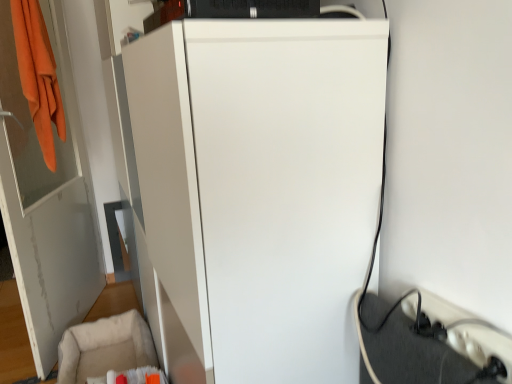
Question: Is white plastic extension cord at lower right positioned far away from white glossy door at left?

Choices:
 (A) no
 (B) yes

Answer: (B)

Question: Is white plastic extension cord at lower right smaller than white glossy door at left?

Choices:
 (A) no
 (B) yes

Answer: (B)

Question: Can we say white plastic extension cord at lower right lies outside white glossy door at left?

Choices:
 (A) no
 (B) yes

Answer: (B)

Question: Is white plastic extension cord at lower right shorter than white glossy door at left?

Choices:
 (A) yes
 (B) no

Answer: (A)

Question: Could you tell me if white plastic extension cord at lower right is turned towards white glossy door at left?

Choices:
 (A) no
 (B) yes

Answer: (A)

Question: From the image's perspective, is white glossy door at left above or below white plastic extension cord at lower right?

Choices:
 (A) below
 (B) above

Answer: (B)

Question: Is white glossy door at left inside or outside of white plastic extension cord at lower right?

Choices:
 (A) outside
 (B) inside

Answer: (A)

Question: In terms of width, does white glossy door at left look wider or thinner when compared to white plastic extension cord at lower right?

Choices:
 (A) wide
 (B) thin

Answer: (A)

Question: In the image, is white glossy door at left on the left side or the right side of white plastic extension cord at lower right?

Choices:
 (A) right
 (B) left

Answer: (B)

Question: From a real-world perspective, is beige fabric swivel chair at lower left physically located above or below white plastic extension cord at lower right?

Choices:
 (A) below
 (B) above

Answer: (A)

Question: Does point (68, 339) appear closer or farther from the camera than point (424, 297)?

Choices:
 (A) closer
 (B) farther

Answer: (B)

Question: From their relative heights in the image, would you say beige fabric swivel chair at lower left is taller or shorter than white plastic extension cord at lower right?

Choices:
 (A) short
 (B) tall

Answer: (B)

Question: In the image, is beige fabric swivel chair at lower left positioned in front of or behind white plastic extension cord at lower right?

Choices:
 (A) front
 (B) behind

Answer: (B)

Question: Considering the relative positions of beige fabric swivel chair at lower left and white matte refrigerator at center in the image provided, is beige fabric swivel chair at lower left to the left or to the right of white matte refrigerator at center?

Choices:
 (A) right
 (B) left

Answer: (B)

Question: In terms of width, does beige fabric swivel chair at lower left look wider or thinner when compared to white matte refrigerator at center?

Choices:
 (A) wide
 (B) thin

Answer: (B)